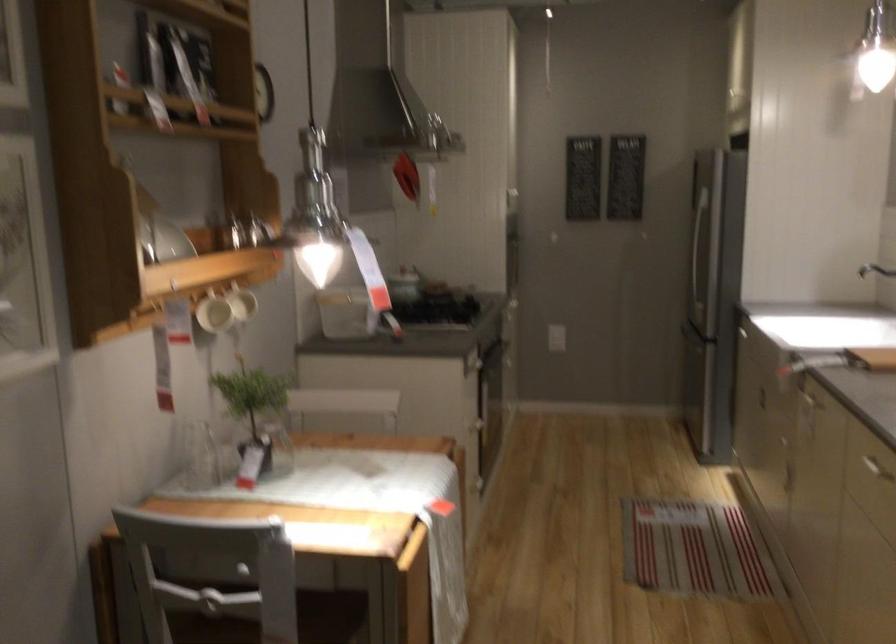
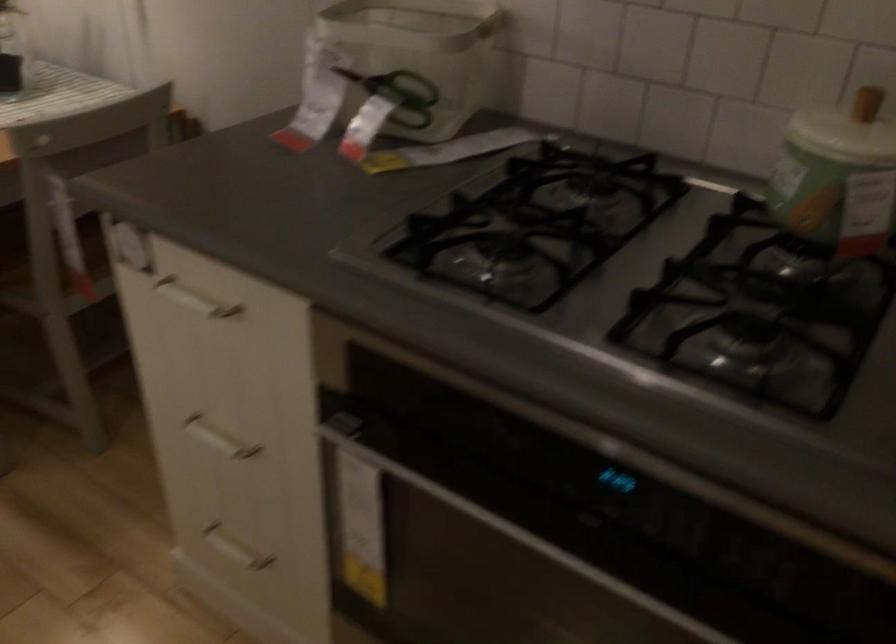
Where in the second image is the point corresponding to point (478, 370) from the first image?

(194, 299)